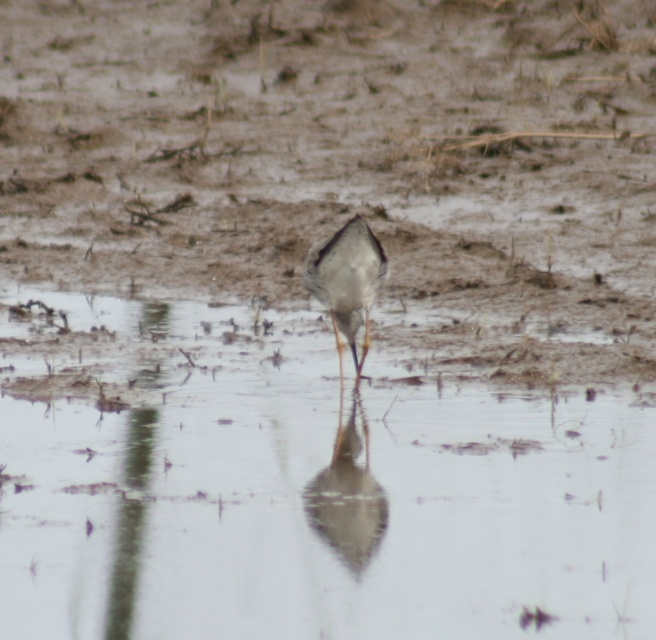
Is smooth gray bird at center positioned in front of gray matte bird at center?

Yes, it is in front of gray matte bird at center.

Where is `smooth gray bird at center`? smooth gray bird at center is located at coordinates (348, 496).

What are the coordinates of `smooth gray bird at center` in the screenshot? It's located at (348, 496).

Can you confirm if clear water at center is positioned to the left of smooth gray bird at center?

Yes, clear water at center is to the left of smooth gray bird at center.

Who is shorter, clear water at center or smooth gray bird at center?

smooth gray bird at center

Is point (26, 486) positioned in front of point (344, 513)?

No, it is not.

Find the location of a particular element. Image resolution: width=656 pixels, height=640 pixels. clear water at center is located at coordinates (302, 486).

Is clear water at center positioned behind gray matte bird at center?

That is False.

Can you confirm if clear water at center is bigger than gray matte bird at center?

Yes.

Which is behind, point (47, 461) or point (344, 326)?

The point (344, 326) is more distant.

Find the location of a particular element. This screenshot has height=640, width=656. clear water at center is located at coordinates (302, 486).